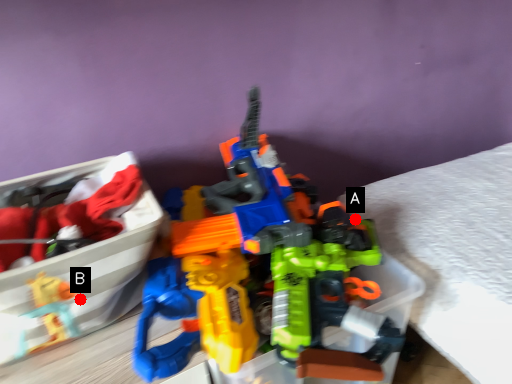
Question: Two points are circled on the image, labeled by A and B beside each circle. Which point is closer to the camera taking this photo?

Choices:
 (A) A is closer
 (B) B is closer

Answer: (B)